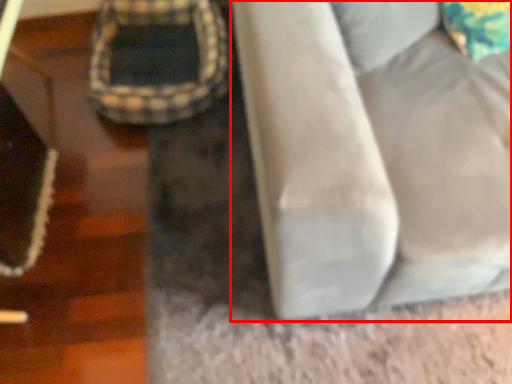
Question: From the image's perspective, considering the relative positions of furniture (annotated by the red box) and bean bag chair in the image provided, where is furniture (annotated by the red box) located with respect to the staircase?

Choices:
 (A) below
 (B) above

Answer: (A)